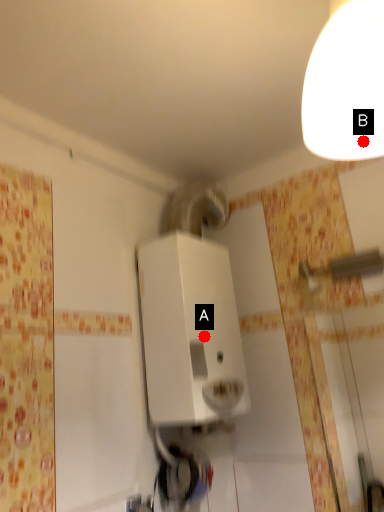
Question: Two points are circled on the image, labeled by A and B beside each circle. Which point appears farthest from the camera in this image?

Choices:
 (A) A is further
 (B) B is further

Answer: (A)